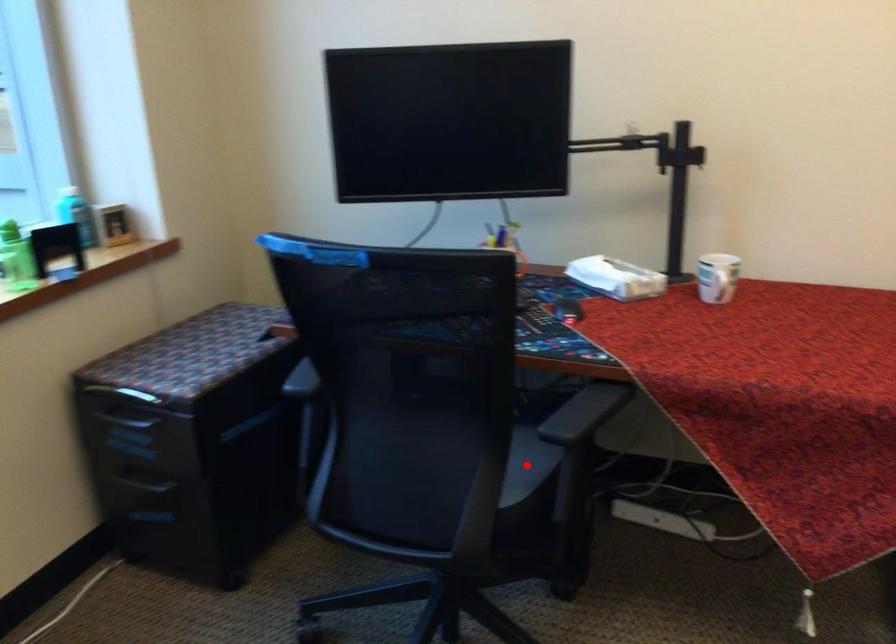
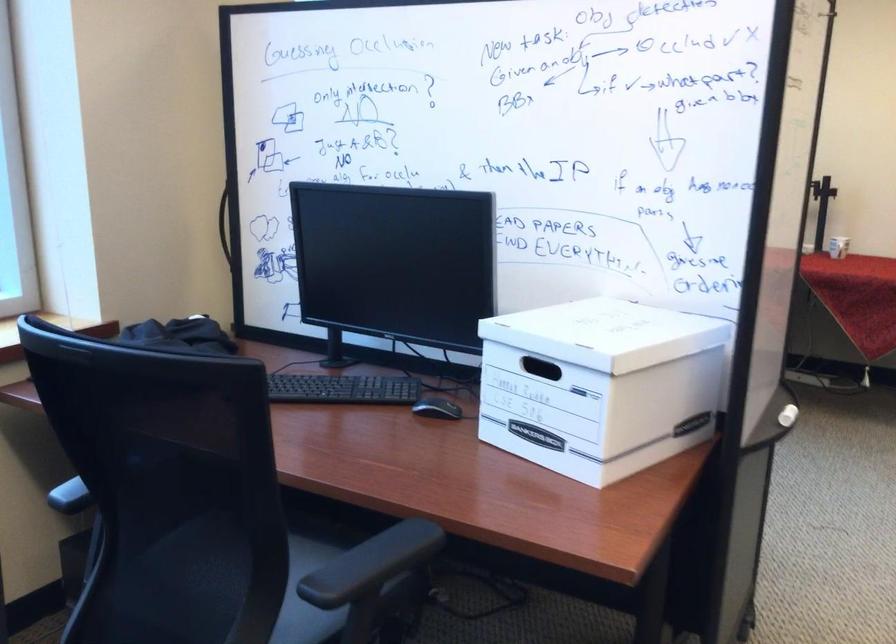
Question: I am providing you with two images of the same scene from different viewpoints. A red point is marked on the first image. Is the red point's position out of view in image 2?

Choices:
 (A) Yes
 (B) No

Answer: (A)